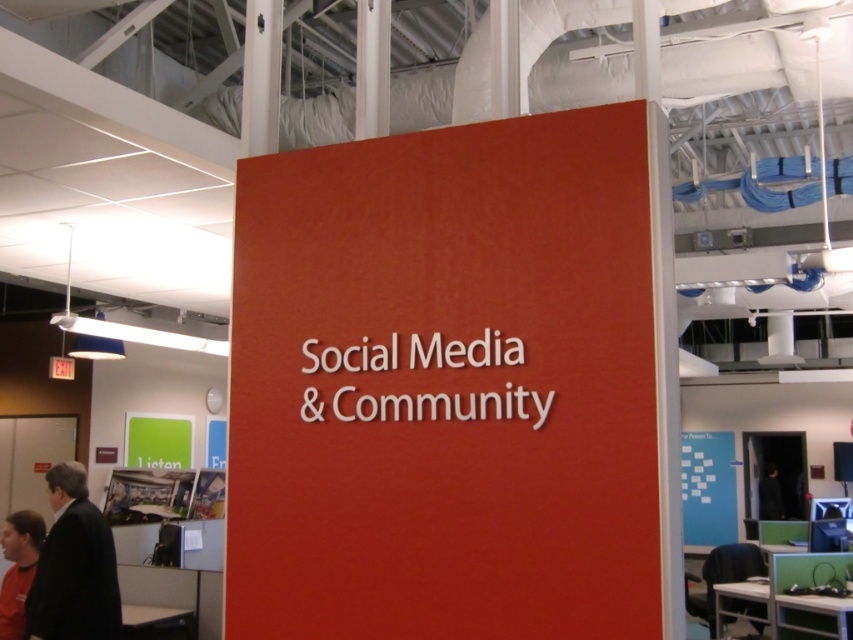
What do you see at coordinates (74, 566) in the screenshot?
I see `dark suit at lower left` at bounding box center [74, 566].

Between dark suit at lower left and matte black shirt at lower left, which one is positioned higher?

Positioned higher is dark suit at lower left.

Is point (91, 616) in front of point (33, 536)?

That is True.

Find the location of a particular element. The height and width of the screenshot is (640, 853). dark suit at lower left is located at coordinates (74, 566).

Is matte red sign at center below dark suit at lower left?

No.

Between matte red sign at center and dark suit at lower left, which one has more height?

With more height is matte red sign at center.

Locate an element on the screen. Image resolution: width=853 pixels, height=640 pixels. matte red sign at center is located at coordinates (445, 385).

At what (x,y) coordinates should I click in order to perform the action: click on matte red sign at center. Please return your answer as a coordinate pair (x, y). Looking at the image, I should click on (445, 385).

Measure the distance from matte red sign at center to matte black shirt at lower left.

A distance of 10.29 feet exists between matte red sign at center and matte black shirt at lower left.

Based on the photo, does matte red sign at center have a smaller size compared to matte black shirt at lower left?

Incorrect, matte red sign at center is not smaller in size than matte black shirt at lower left.

Does point (355, 168) come closer to viewer compared to point (13, 595)?

Yes, point (355, 168) is closer to viewer.

Identify the location of matte red sign at center. (445, 385).